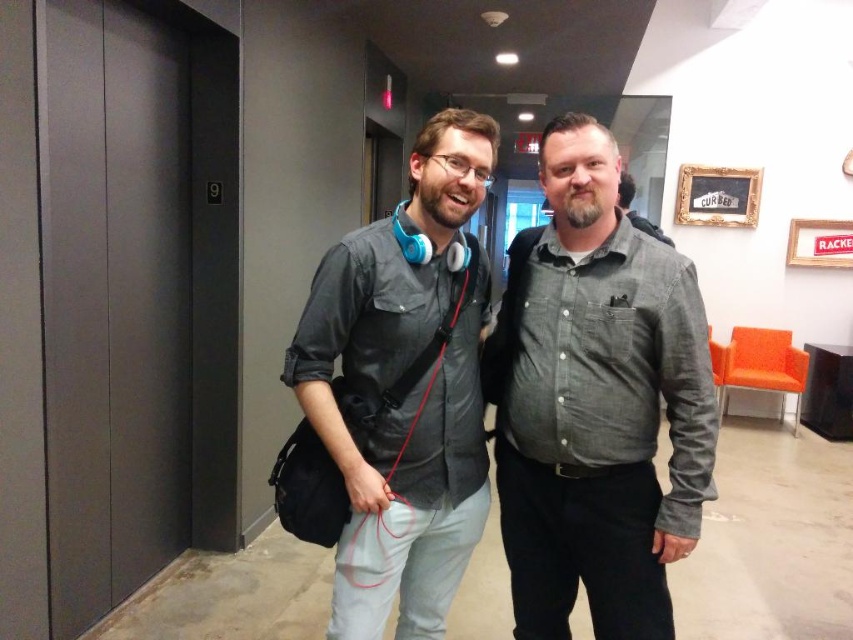
You are a photographer standing 1 meter away from the two shirts in the image. The gray cotton shirt at center and the matte gray shirt at center are part of a photoshoot setup. Can you fit both shirts into your camera frame if your camera has a maximum field of view of 30 centimeters?

The gray cotton shirt at center is 27.12 centimeters away from the matte gray shirt at center. Since the distance between them is less than the camera field of view of 30 centimeters, both shirts can fit into the camera frame.

You are standing at the point labeled point [231,61]. You want to walk to the elevator which is located at the opposite end of the hallway. The hallway is 15 feet long. If you walk at a speed of 3 feet per second, how many seconds will it take you to reach the elevator?

The hallway is 15 feet long, so it will take 15 divided by 3 equals 5 seconds to reach the elevator.

You are a delivery robot with a width of 1 meter. You are in the office and need to move from the matte gray elevator at left to the gray cotton shirt at center. Can you navigate the space between them without any obstacles?

The distance between the matte gray elevator at left and the gray cotton shirt at center is 1.39 meters. Since the robot is 1 meter wide, there is sufficient space for it to navigate between them without any issues.